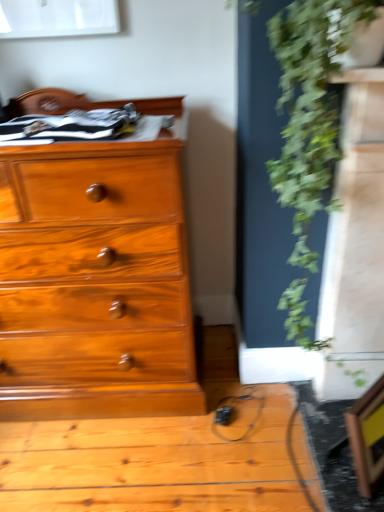
Question: Should I look upward or downward to see green leafy plant at right?

Choices:
 (A) up
 (B) down

Answer: (A)